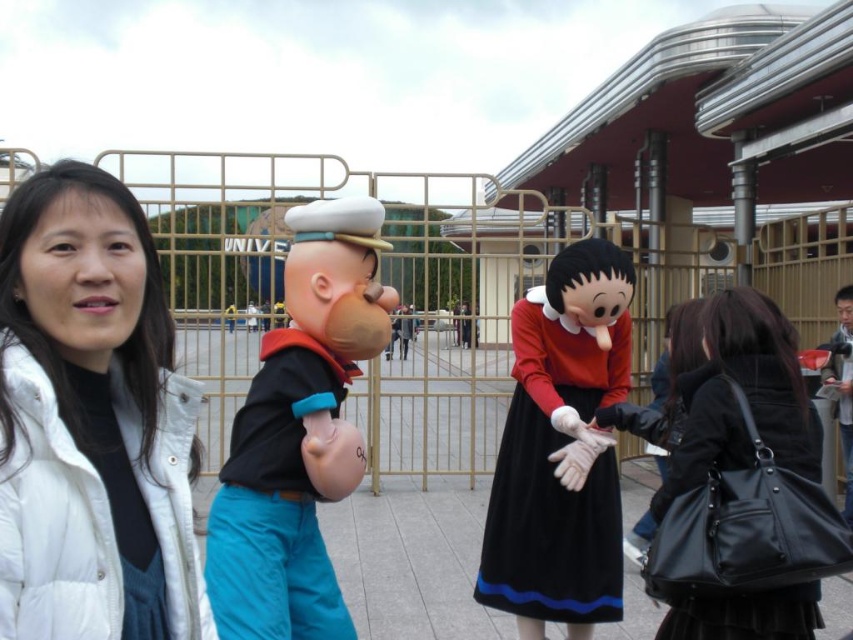
Question: Which of the following is the closest to the observer?

Choices:
 (A) (582, 348)
 (B) (683, 477)
 (C) (283, 388)

Answer: (B)

Question: Which object is farther from the camera taking this photo?

Choices:
 (A) white down jacket at left
 (B) velvet black dress at center
 (C) matte black sailor at center
 (D) black leather bag at lower right

Answer: (B)

Question: Which of these objects is positioned farthest from the black leather bag at lower right?

Choices:
 (A) white down jacket at left
 (B) velvet black dress at center

Answer: (A)

Question: Does white down jacket at left have a smaller size compared to black leather bag at lower right?

Choices:
 (A) no
 (B) yes

Answer: (A)

Question: Does white down jacket at left appear under black leather bag at lower right?

Choices:
 (A) no
 (B) yes

Answer: (A)

Question: Can you confirm if velvet black dress at center is positioned to the right of black leather bag at lower right?

Choices:
 (A) no
 (B) yes

Answer: (A)